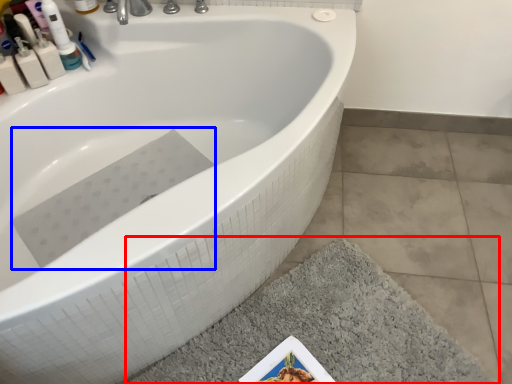
Question: Which object appears farthest to the camera in this image, bath mat (highlighted by a red box) or bath towel (highlighted by a blue box)?

Choices:
 (A) bath mat
 (B) bath towel

Answer: (B)